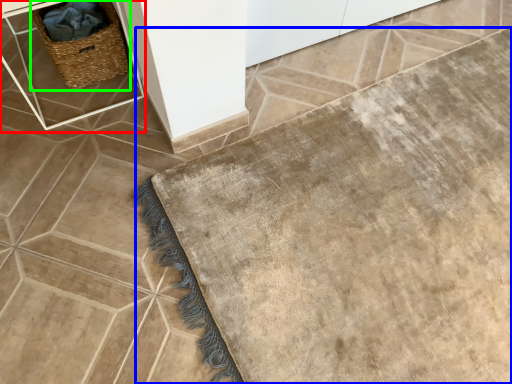
Question: Based on their relative distances, which object is farther from table (highlighted by a red box)? Choose from bath mat (highlighted by a blue box) and picnic basket (highlighted by a green box).

Choices:
 (A) bath mat
 (B) picnic basket

Answer: (A)